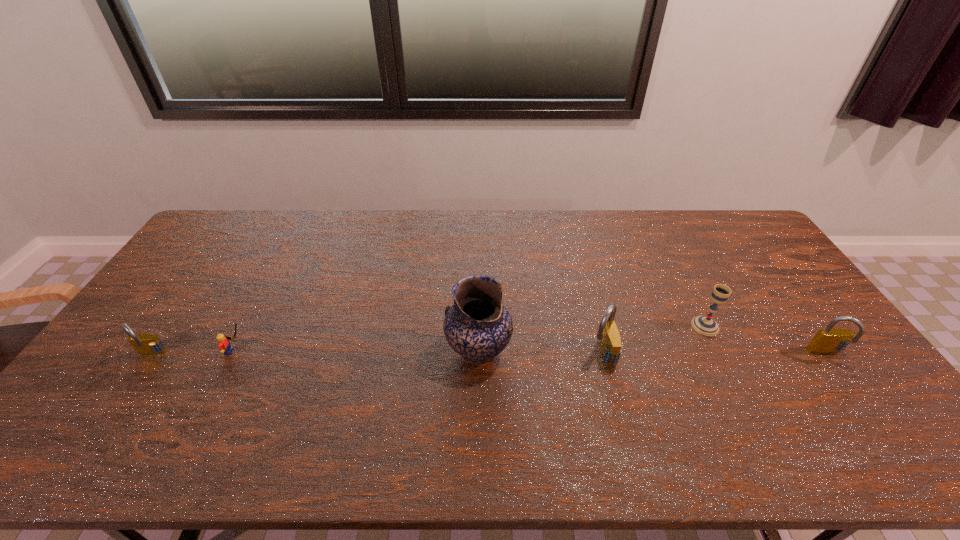
The height and width of the screenshot is (540, 960). I want to click on the leftmost object, so click(x=146, y=344).

The image size is (960, 540). I want to click on the leftmost padlock, so click(x=146, y=344).

Identify the location of the third object from right to left. The image size is (960, 540). (610, 344).

The image size is (960, 540). Identify the location of the second tallest padlock. (830, 340).

The image size is (960, 540). In order to click on the rightmost padlock in this screenshot , I will do `click(830, 340)`.

Find the location of `the second object from right to left`. the second object from right to left is located at coordinates (705, 325).

I want to click on the fifth object from right to left, so click(x=224, y=344).

The height and width of the screenshot is (540, 960). Find the location of `the shortest object`. the shortest object is located at coordinates (224, 344).

Locate an element on the screen. This screenshot has width=960, height=540. the tallest object is located at coordinates (478, 327).

Where is `pottery`? This screenshot has width=960, height=540. pottery is located at coordinates (478, 327).